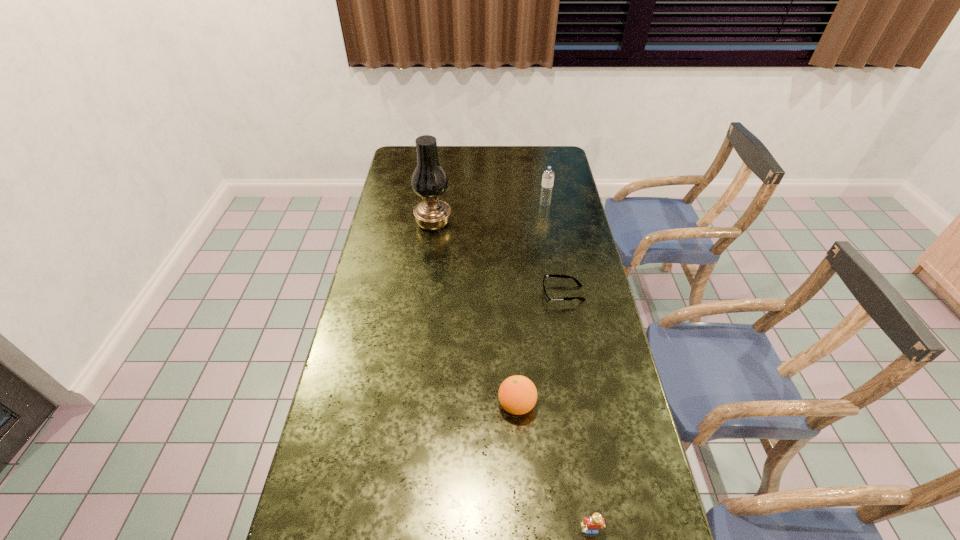
Identify the location of free space that satisfies the following two spatial constraints: 1. on the front-facing side of the third farthest object; 2. on the front-facing side of the nearest object. The width and height of the screenshot is (960, 540). (606, 530).